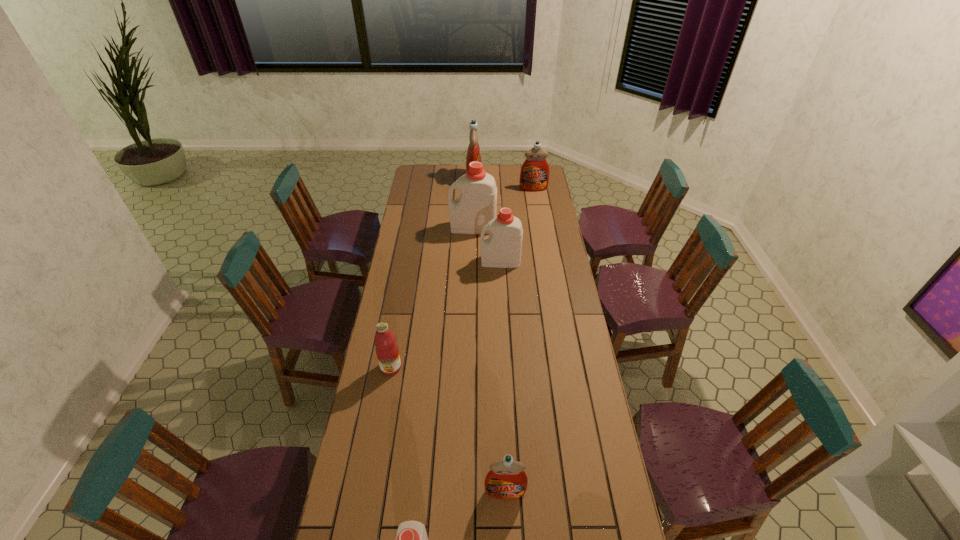
The image size is (960, 540). Identify the location of free space located 0.090m on the front surface of the nearest red detergent. (507, 534).

Find the location of a particular element. The height and width of the screenshot is (540, 960). object located at the far edge is located at coordinates (473, 153).

The image size is (960, 540). I want to click on object at the left edge, so click(387, 351).

Locate an element on the screen. The height and width of the screenshot is (540, 960). object that is at the right edge is located at coordinates (534, 176).

The height and width of the screenshot is (540, 960). Find the location of `free space at the left edge of the desktop`. free space at the left edge of the desktop is located at coordinates (407, 281).

You are a GUI agent. You are given a task and a screenshot of the screen. Output one action in this format:
    pyautogui.click(x=<x>, y=<y>)
    Task: Click on the vacant space at the right edge of the desktop
    The height and width of the screenshot is (540, 960).
    Given the screenshot: What is the action you would take?
    pyautogui.click(x=578, y=388)

What are the coordinates of `free location at the far left corner` in the screenshot? It's located at (414, 180).

The height and width of the screenshot is (540, 960). Identify the location of vacant point located between the smallest red detergent and the rightmost detergent. (519, 340).

The width and height of the screenshot is (960, 540). Identify the location of vacant region between the third farthest object and the pink fruit juice. (432, 298).

Find the location of a particular element. This screenshot has width=960, height=540. object identified as the second closest to the third farthest object is located at coordinates (473, 153).